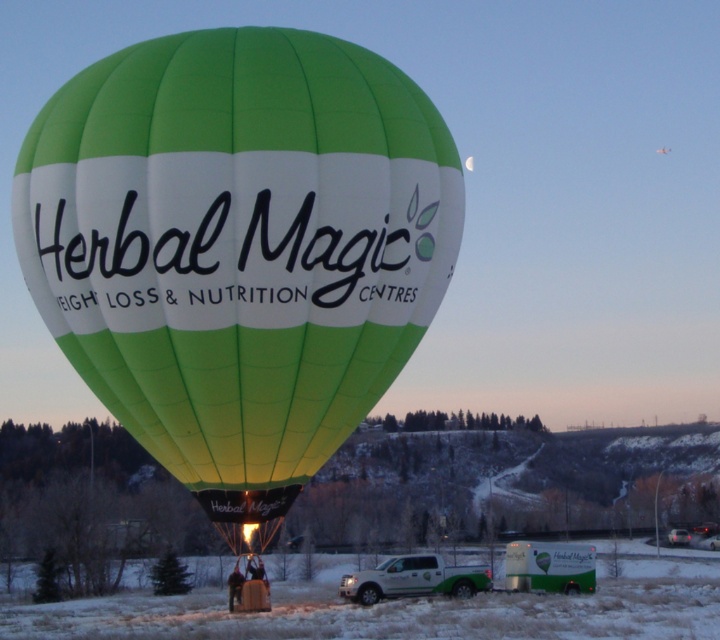
Can you confirm if green fabric hot air balloon at center is taller than green fabric balloon at center?

Yes.

Which of these two, green fabric hot air balloon at center or green fabric balloon at center, stands shorter?

Standing shorter between the two is green fabric balloon at center.

Is point (243, 100) more distant than point (168, 257)?

Yes, point (243, 100) is behind point (168, 257).

Where is `green fabric hot air balloon at center`? This screenshot has height=640, width=720. green fabric hot air balloon at center is located at coordinates (238, 246).